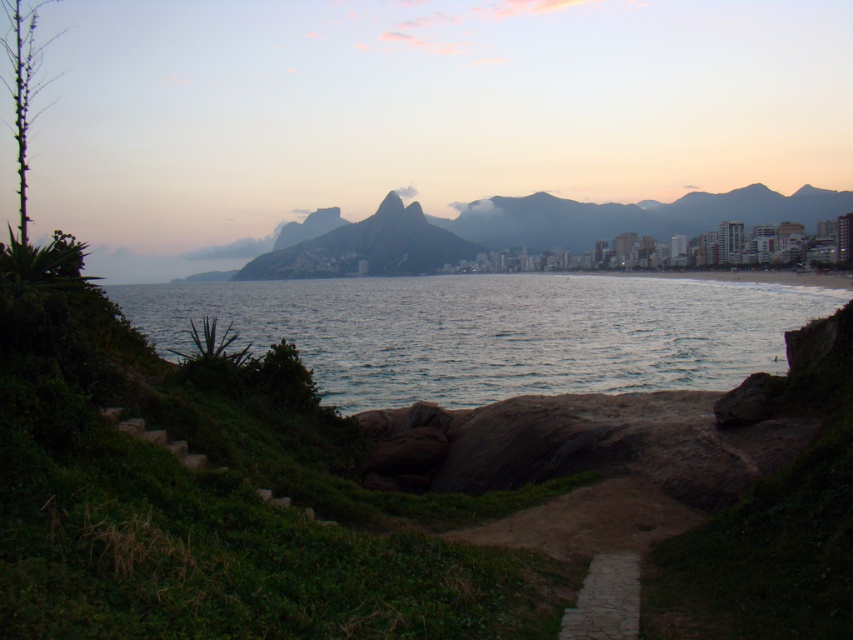
Between point (404, 262) and point (613, 608), which one is positioned in front?

Point (613, 608) is more forward.

Can you confirm if rugged granite mountain at center is positioned above stone paved path at lower center?

Yes.

This screenshot has height=640, width=853. Describe the element at coordinates (367, 248) in the screenshot. I see `rugged granite mountain at center` at that location.

In order to click on rugged granite mountain at center in this screenshot , I will do `click(367, 248)`.

Which is behind, point (761, 355) or point (381, 248)?

The point (381, 248) is behind.

Describe the element at coordinates (492, 332) in the screenshot. I see `blue water at center` at that location.

The height and width of the screenshot is (640, 853). What do you see at coordinates (492, 332) in the screenshot?
I see `blue water at center` at bounding box center [492, 332].

The image size is (853, 640). I want to click on blue water at center, so click(x=492, y=332).

What do you see at coordinates (492, 332) in the screenshot? I see `blue water at center` at bounding box center [492, 332].

Between point (532, 300) and point (618, 612), which one is positioned behind?

The point (532, 300) is more distant.

You are a GUI agent. You are given a task and a screenshot of the screen. Output one action in this format:
    pyautogui.click(x=<x>, y=<y>)
    Task: Click on the blue water at center
    The image size is (853, 640).
    Given the screenshot: What is the action you would take?
    pyautogui.click(x=492, y=332)